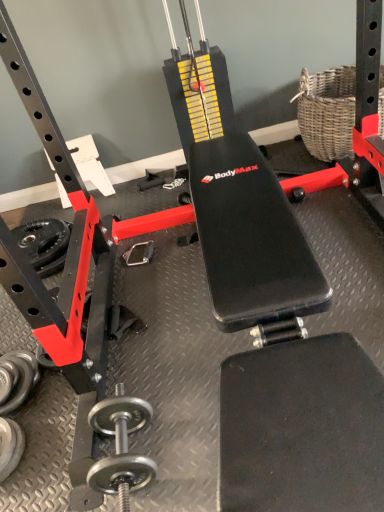
Locate an element on the screen. The width and height of the screenshot is (384, 512). vacant space behind polished silver dumbbell at lower left, which ranks as the third dumbbell in left-to-right order is located at coordinates (125, 378).